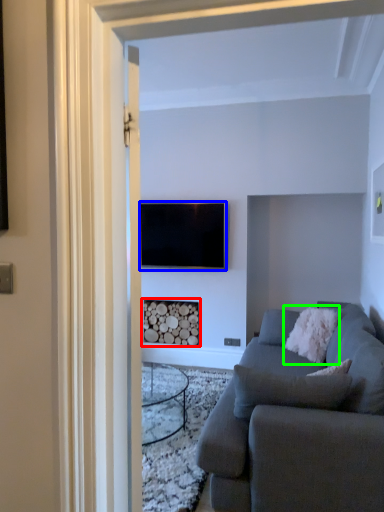
Question: Which object is the farthest from fireplace (highlighted by a red box)? Choose among these: television (highlighted by a blue box) or pillow (highlighted by a green box).

Choices:
 (A) television
 (B) pillow

Answer: (B)